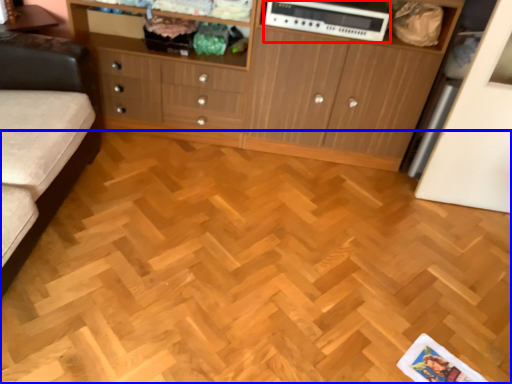
Question: Which of the following is the farthest to the observer, appliance (highlighted by a red box) or plywood (highlighted by a blue box)?

Choices:
 (A) appliance
 (B) plywood

Answer: (A)